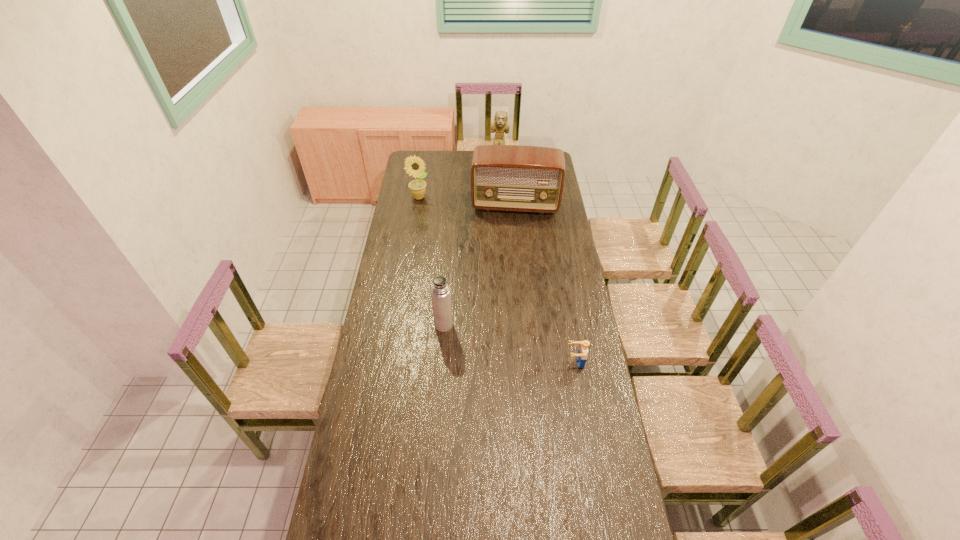
Locate an element on the screen. the fourth farthest object is located at coordinates (440, 291).

Locate an element on the screen. This screenshot has height=540, width=960. the second object from left to right is located at coordinates (440, 291).

Identify the location of Lego. The height and width of the screenshot is (540, 960). (581, 357).

Identify the location of the shortest object. (581, 357).

Find the location of `sunflower`. sunflower is located at coordinates (415, 166).

Locate an element on the screen. radio receiver is located at coordinates (521, 178).

Locate an element on the screen. The height and width of the screenshot is (540, 960). the farthest object is located at coordinates (500, 124).

Locate an element on the screen. Image resolution: width=960 pixels, height=540 pixels. vacant position located 0.160m on the front of the second nearest object is located at coordinates (441, 364).

Find the location of a particular element. vacant space located on the face of the nearest object is located at coordinates (518, 362).

At what (x,y) coordinates should I click in order to perform the action: click on vacant space located on the face of the nearest object. Please return your answer as a coordinate pair (x, y). The height and width of the screenshot is (540, 960). Looking at the image, I should click on (534, 362).